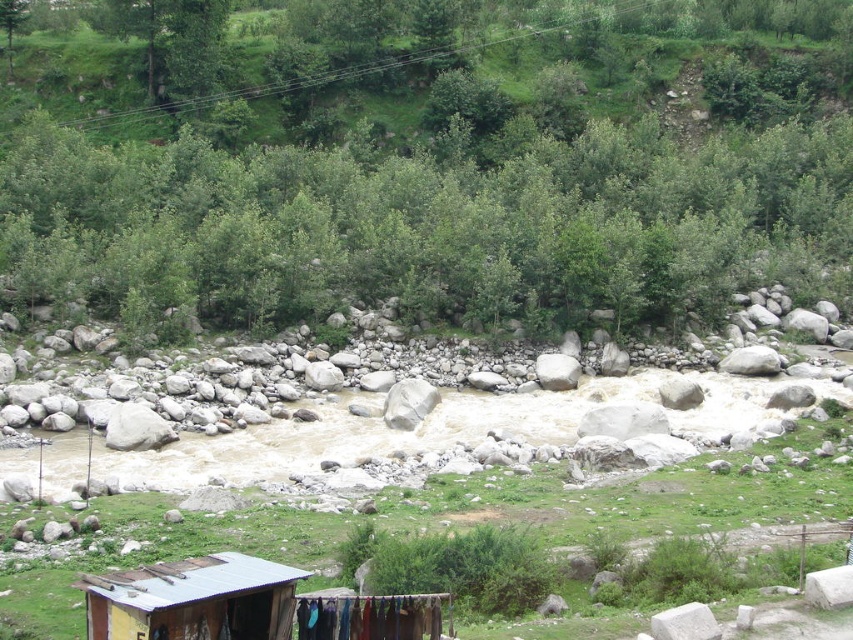
Question: Does green leafy tree at upper center appear on the right side of green grass at center?

Choices:
 (A) yes
 (B) no

Answer: (B)

Question: Which object is the closest to the rusty metal hut at lower left?

Choices:
 (A) green leafy tree at upper center
 (B) green grass at center

Answer: (B)

Question: Among these points, which one is nearest to the camera?

Choices:
 (A) (141, 307)
 (B) (546, 468)

Answer: (B)

Question: Which of these objects is positioned farthest from the green grass at center?

Choices:
 (A) green leafy tree at upper center
 (B) rusty metal hut at lower left

Answer: (A)

Question: Can you confirm if green leafy tree at upper center is positioned to the right of rusty metal hut at lower left?

Choices:
 (A) no
 (B) yes

Answer: (A)

Question: Does green leafy tree at upper center appear over green grass at center?

Choices:
 (A) yes
 (B) no

Answer: (A)